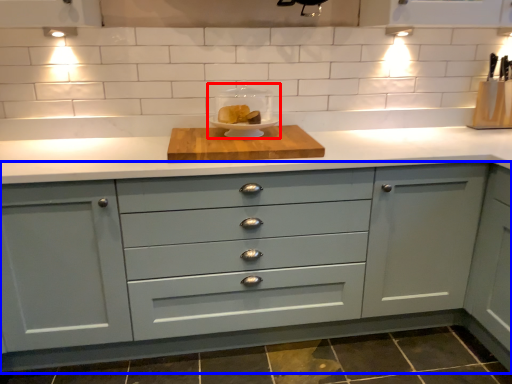
Question: Which object appears closest to the camera in this image, appliance (highlighted by a red box) or cabinetry (highlighted by a blue box)?

Choices:
 (A) appliance
 (B) cabinetry

Answer: (B)